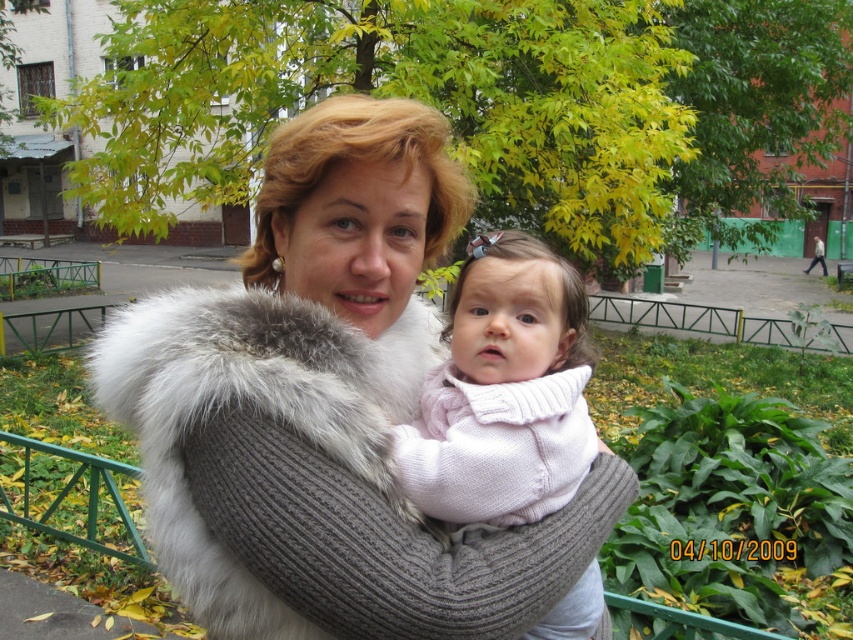
You are a fashion designer observing this autumn scene. You notice the gray furry scarf at center and the pink knitted sweater at center. Which clothing item appears larger in height when viewed from the front?

The gray furry scarf at center is taller than the pink knitted sweater at center, so the gray furry scarf at center appears larger in height.

You are a photographer trying to capture a closeup of the gray furry scarf at center and the pink knitted sweater at center. Which one will appear larger in the photo?

The gray furry scarf at center will appear larger in the photo because it is closer to the viewer than the pink knitted sweater at center.